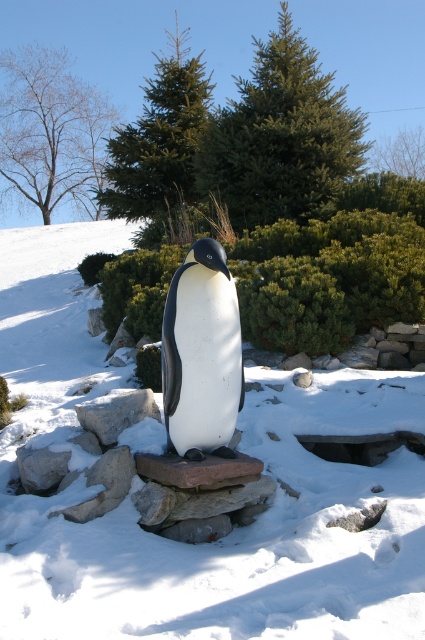
You are an artist planning to paint the winter scene. You want to ensure the white snow at center and gray stone at center are proportionally accurate. Which object should you depict as taller in your painting?

The white snow at center should be depicted as taller than the gray stone at center, as the description states it is much taller.

You are standing at the point marked by the coordinate point [234,529]. Based on the scene description, what is the terrain like at your current location?

The point [234,529] marks white snow at center, so the terrain at your current location is white snow.

You are planning to place a small decorative snowman on the white snow at center. Considering the size of the white matte penguin at center, will the snowman fit without overlapping the penguin?

The white snow at center might be wider than the white matte penguin at center, so there is a possibility that the snowman can be placed without overlapping, but it depends on the exact dimensions.